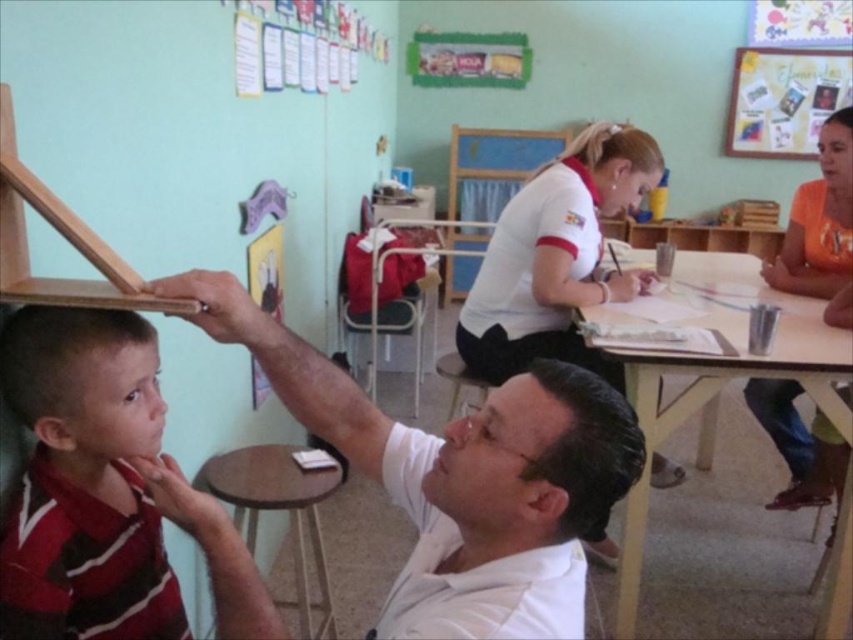
Question: Considering the relative positions of striped fabric shirt at left and matte whiteboard at upper center in the image provided, where is striped fabric shirt at left located with respect to matte whiteboard at upper center?

Choices:
 (A) right
 (B) left

Answer: (B)

Question: Which of these objects is positioned closest to the orange cotton shirt at right?

Choices:
 (A) white matte shirt at upper center
 (B) wooden table at center

Answer: (B)

Question: Is white matte shirt at upper center thinner than wooden round table at center?

Choices:
 (A) no
 (B) yes

Answer: (A)

Question: Is orange cotton shirt at right in front of light brown wood easel at upper left?

Choices:
 (A) yes
 (B) no

Answer: (B)

Question: Which object appears closest to the camera in this image?

Choices:
 (A) wooden table at center
 (B) matte whiteboard at upper center
 (C) wooden round table at center
 (D) striped fabric shirt at left

Answer: (D)

Question: Among these objects, which one is farthest from the camera?

Choices:
 (A) light brown wood easel at upper left
 (B) striped fabric shirt at left
 (C) white smooth shirt at upper center

Answer: (C)